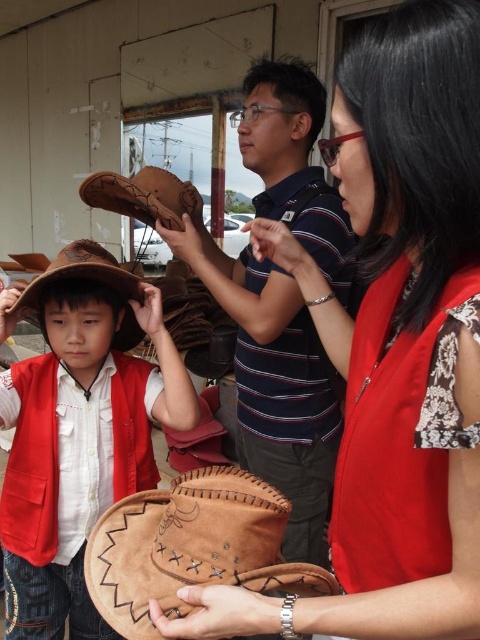
Between leather hat at center and suede cowboy hat at center, which one is positioned higher?

leather hat at center

Does point (469, 321) come farther from viewer compared to point (29, 611)?

No, (469, 321) is closer to viewer.

The width and height of the screenshot is (480, 640). I want to click on leather hat at center, so pos(394,346).

Between leather hat at center and brown suede cowboy hat at left, which one appears on the right side from the viewer's perspective?

leather hat at center is more to the right.

Which of these two, leather hat at center or brown suede cowboy hat at left, stands taller?

With more height is leather hat at center.

The image size is (480, 640). Find the location of `leather hat at center`. leather hat at center is located at coordinates (394, 346).

Who is more forward, [43,454] or [34,288]?

Point [34,288] is in front.

Does point (44, 502) lie in front of point (37, 294)?

That is False.

The height and width of the screenshot is (640, 480). In order to click on suede cowboy hat at center in this screenshot , I will do `click(78, 432)`.